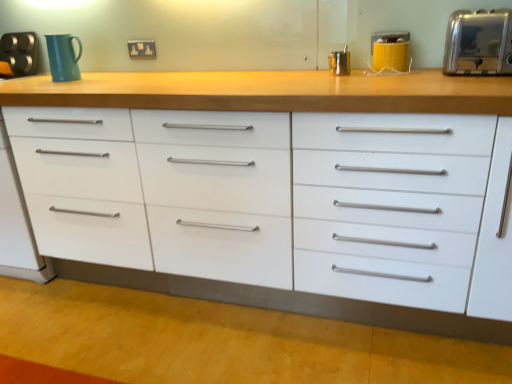
Find the location of a particular element. free space in front of matte teal mug at upper left is located at coordinates (48, 79).